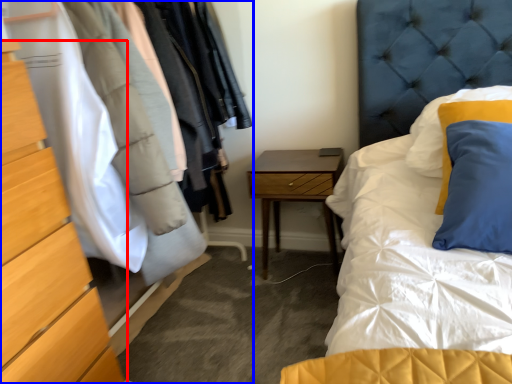
Question: Which object appears closest to the camera in this image, chest of drawers (highlighted by a red box) or dresser (highlighted by a blue box)?

Choices:
 (A) chest of drawers
 (B) dresser

Answer: (A)